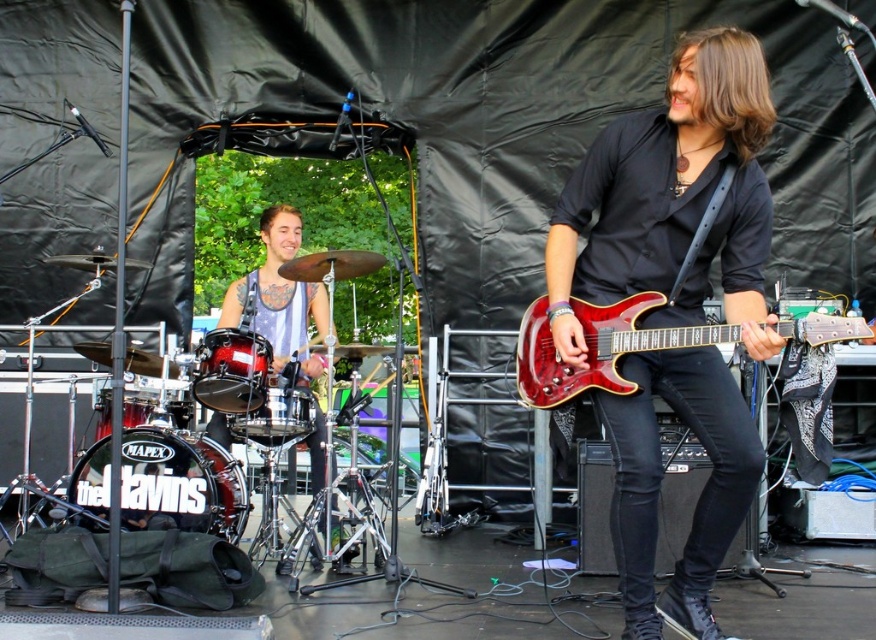
Question: Which object appears farthest from the camera in this image?

Choices:
 (A) shiny red guitar at center
 (B) glossy wood guitar at center

Answer: (A)

Question: Does shiny red guitar at center appear under glossy wood guitar at center?

Choices:
 (A) no
 (B) yes

Answer: (A)

Question: Among these points, which one is farthest from the camera?

Choices:
 (A) (613, 346)
 (B) (668, 310)

Answer: (B)

Question: Can you confirm if shiny red guitar at center is wider than glossy wood guitar at center?

Choices:
 (A) yes
 (B) no

Answer: (B)

Question: Does shiny red guitar at center have a greater width compared to glossy wood guitar at center?

Choices:
 (A) no
 (B) yes

Answer: (A)